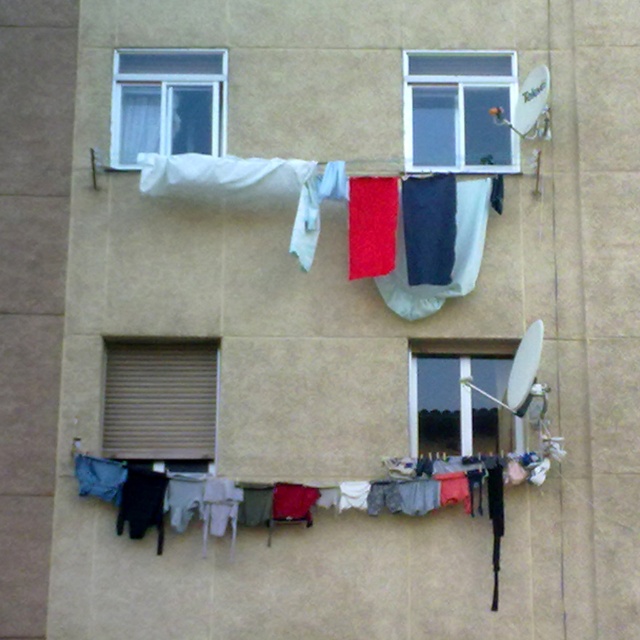
Who is lower down, textured fabric clothesline at lower center or clear glass window at upper center?

textured fabric clothesline at lower center is below.

Does textured fabric clothesline at lower center appear on the left side of clear glass window at upper center?

Yes, textured fabric clothesline at lower center is to the left of clear glass window at upper center.

I want to click on textured fabric clothesline at lower center, so click(x=188, y=499).

You are a GUI agent. You are given a task and a screenshot of the screen. Output one action in this format:
    pyautogui.click(x=<x>, y=<y>)
    Task: Click on the textured fabric clothesline at lower center
    Image resolution: width=640 pixels, height=640 pixels.
    Given the screenshot: What is the action you would take?
    pyautogui.click(x=188, y=499)

Between point (492, 154) and point (419, 452), which one is positioned in front?

Point (419, 452) is more forward.

Who is positioned more to the left, clear glass window at upper center or transparent glass window at center?

transparent glass window at center is more to the left.

Which is in front, point (417, 164) or point (484, 406)?

Point (484, 406)

You are a GUI agent. You are given a task and a screenshot of the screen. Output one action in this format:
    pyautogui.click(x=<x>, y=<y>)
    Task: Click on the clear glass window at upper center
    The image size is (640, 640).
    Given the screenshot: What is the action you would take?
    pyautogui.click(x=458, y=109)

Is point (148, 442) behind point (403, 96)?

No.

The width and height of the screenshot is (640, 640). Describe the element at coordinates (160, 401) in the screenshot. I see `brown matte shutter at lower left` at that location.

What are the coordinates of `brown matte shutter at lower left` in the screenshot? It's located at (160, 401).